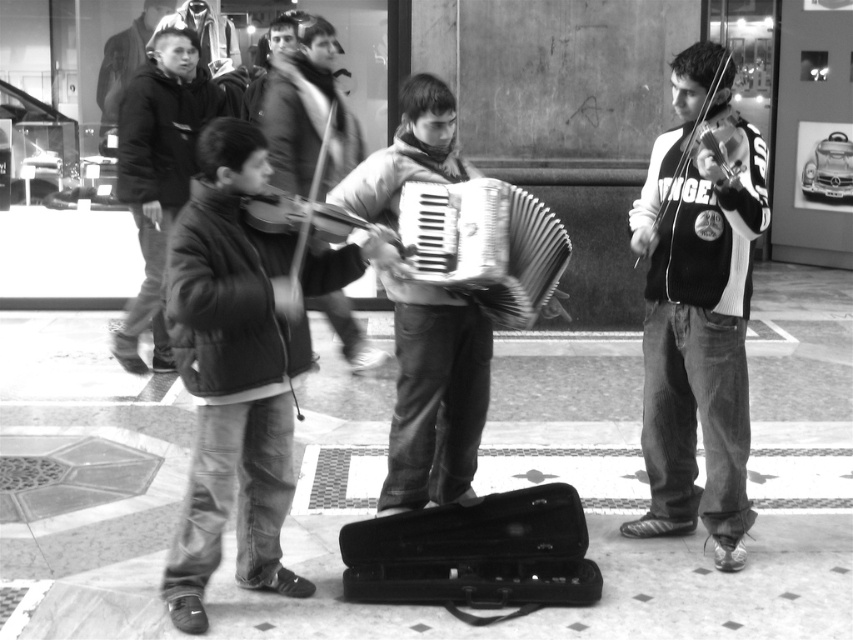
Does white sweater at right appear over metallic silver accordion at center?

No.

Does white sweater at right appear under metallic silver accordion at center?

Yes.

The height and width of the screenshot is (640, 853). Identify the location of white sweater at right. (698, 308).

Is white sweater at right shorter than shiny black violin at right?

No, white sweater at right is not shorter than shiny black violin at right.

Is point (682, 353) less distant than point (679, 100)?

No.

Who is more distant from viewer, (741,454) or (636,244)?

The point (741,454) is behind.

What are the coordinates of `white sweater at right` in the screenshot? It's located at (698, 308).

Is metallic silver accordion at center bigger than shiny black violin at right?

Yes, metallic silver accordion at center is bigger than shiny black violin at right.

Consider the image. Can you confirm if metallic silver accordion at center is shorter than shiny black violin at right?

In fact, metallic silver accordion at center may be taller than shiny black violin at right.

Image resolution: width=853 pixels, height=640 pixels. I want to click on metallic silver accordion at center, so click(485, 244).

At what (x,y) coordinates should I click in order to perform the action: click on metallic silver accordion at center. Please return your answer as a coordinate pair (x, y). Looking at the image, I should click on (485, 244).